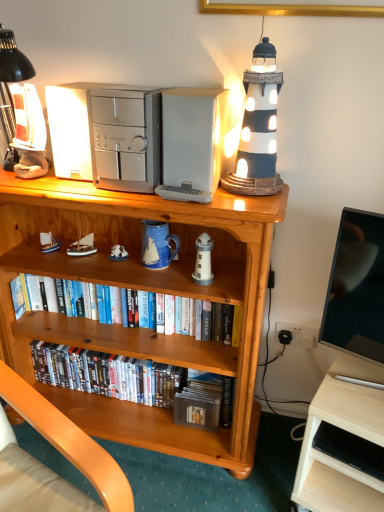
You are a GUI agent. You are given a task and a screenshot of the screen. Output one action in this format:
    pyautogui.click(x=<x>, y=<y>)
    Task: Click on the satin silver appliance at upper left, positioned as the 1th appliance in left-to-right order
    The image size is (384, 512).
    Given the screenshot: What is the action you would take?
    pyautogui.click(x=72, y=130)

Describe the element at coordinates (203, 260) in the screenshot. The width and height of the screenshot is (384, 512). I see `white matte lighthouse at center, which is counted as the 1th toy, starting from the front` at that location.

How much space does white plastic microwave at upper center, which is the 1th appliance from right to left, occupy horizontally?

It is 9.01 inches.

Measure the distance between white wood desk at lower right and camera.

white wood desk at lower right is 3.36 feet away from camera.

This screenshot has width=384, height=512. What do you see at coordinates (118, 253) in the screenshot? I see `white ceramic figurine at center, which appears as the 2th toy when viewed from the right` at bounding box center [118, 253].

Identify the location of white ceramic figurine at center, which appears as the 2th toy when viewed from the right. (118, 253).

Find the location of `hardcover books at center, which ranks as the second book in top-to-bottom order`. hardcover books at center, which ranks as the second book in top-to-bottom order is located at coordinates coord(107,374).

From the picture: Considering the positions of objects white matte lighthouse at center, marked as the third toy in a left-to-right arrangement, and hardcover books at center, arranged as the second book when ordered from the bottom, in the image provided, who is more to the right, white matte lighthouse at center, marked as the third toy in a left-to-right arrangement, or hardcover books at center, arranged as the second book when ordered from the bottom,?

white matte lighthouse at center, marked as the third toy in a left-to-right arrangement.

From a real-world perspective, does white matte lighthouse at center, which is counted as the 1th toy, starting from the front, stand above hardcover books at center, arranged as the second book when ordered from the bottom?

Yes, from a real-world perspective, white matte lighthouse at center, which is counted as the 1th toy, starting from the front, is on top of hardcover books at center, arranged as the second book when ordered from the bottom.

From the image's perspective, is white matte lighthouse at center, marked as the third toy in a left-to-right arrangement, beneath hardcover books at center, arranged as the first book when viewed from the top?

→ No, from the image's perspective, white matte lighthouse at center, marked as the third toy in a left-to-right arrangement, is not below hardcover books at center, arranged as the first book when viewed from the top.

Could you tell me if satin silver appliance at upper left, positioned as the 1th appliance in left-to-right order, is turned towards satin silver computer tower at upper center, placed as the 2th appliance when sorted from left to right?

No, satin silver appliance at upper left, positioned as the 1th appliance in left-to-right order, is not oriented towards satin silver computer tower at upper center, placed as the 2th appliance when sorted from left to right.

Is point (59, 130) farther from viewer compared to point (146, 173)?

That is True.

From the picture: From a real-world perspective, who is located lower, satin silver appliance at upper left, which ranks as the 3th appliance in right-to-left order, or satin silver computer tower at upper center, placed as the 2th appliance when sorted from left to right?

satin silver appliance at upper left, which ranks as the 3th appliance in right-to-left order, is physically lower.

Where is `appliance that is the 2nd object located in front of the satin silver appliance at upper left, positioned as the 1th appliance in left-to-right order`? The height and width of the screenshot is (512, 384). appliance that is the 2nd object located in front of the satin silver appliance at upper left, positioned as the 1th appliance in left-to-right order is located at coordinates (126, 139).

Choose the correct answer: Is hardcover books at center, which is counted as the first book, starting from the bottom, inside matte black lighthouse at upper right or outside it?

hardcover books at center, which is counted as the first book, starting from the bottom, is located beyond the bounds of matte black lighthouse at upper right.

Are hardcover books at center, which ranks as the second book in top-to-bottom order, and matte black lighthouse at upper right beside each other?

No, hardcover books at center, which ranks as the second book in top-to-bottom order, is not next to matte black lighthouse at upper right.

Identify the location of the 2nd book below the matte black lighthouse at upper right (from the image's perspective). This screenshot has height=512, width=384. (107, 374).

What's the angular difference between hardcover books at center, which is counted as the first book, starting from the bottom, and matte black lighthouse at upper right's facing directions?

The angle between the facing direction of hardcover books at center, which is counted as the first book, starting from the bottom, and the facing direction of matte black lighthouse at upper right is 7.42 degrees.

At what (x,y) coordinates should I click in order to perform the action: click on table lamp that is above the white matte lighthouse at center, which is counted as the 1th toy, starting from the front (from the image's perspective). Please return your answer as a coordinate pair (x, y). The image size is (384, 512). Looking at the image, I should click on (258, 128).

Is white matte lighthouse at center, marked as the third toy in a left-to-right arrangement, in contact with matte black lighthouse at upper right?

No, white matte lighthouse at center, marked as the third toy in a left-to-right arrangement, is not in contact with matte black lighthouse at upper right.

Can you confirm if white matte lighthouse at center, which is counted as the 1th toy, starting from the front, is bigger than matte black lighthouse at upper right?

No.

In the scene shown: Which object is thinner, white matte lighthouse at center, which is counted as the 1th toy, starting from the front, or matte black lighthouse at upper right?

With smaller width is white matte lighthouse at center, which is counted as the 1th toy, starting from the front.

Is hardcover books at center, which ranks as the second book in top-to-bottom order, to the left of satin silver appliance at upper left, which ranks as the 3th appliance in right-to-left order, from the viewer's perspective?

In fact, hardcover books at center, which ranks as the second book in top-to-bottom order, is to the right of satin silver appliance at upper left, which ranks as the 3th appliance in right-to-left order.

Does hardcover books at center, which is counted as the first book, starting from the bottom, have a lesser width compared to satin silver appliance at upper left, which ranks as the 3th appliance in right-to-left order?

No.

Is hardcover books at center, which is counted as the first book, starting from the bottom, smaller than satin silver appliance at upper left, positioned as the 1th appliance in left-to-right order?

Actually, hardcover books at center, which is counted as the first book, starting from the bottom, might be larger than satin silver appliance at upper left, positioned as the 1th appliance in left-to-right order.

Between point (67, 379) and point (82, 144), which one is positioned in front?

Point (82, 144)

How far apart are white matte sailboat at upper left, which is counted as the 2th toy, starting from the front, and matte black lighthouse at upper right?

26.35 inches.

Is white matte sailboat at upper left, which appears as the second toy when viewed from the back, closer to the viewer compared to matte black lighthouse at upper right?

No.

From the image's perspective, is white matte sailboat at upper left, which is counted as the 2th toy, starting from the front, positioned above or below matte black lighthouse at upper right?

Based on their image positions, white matte sailboat at upper left, which is counted as the 2th toy, starting from the front, is located beneath matte black lighthouse at upper right.

How different are the orientations of white matte sailboat at upper left, which is counted as the 2th toy, starting from the front, and matte black lighthouse at upper right in degrees?

The angular difference between white matte sailboat at upper left, which is counted as the 2th toy, starting from the front, and matte black lighthouse at upper right is 7.42 degrees.

Does wooden bookcase at center turn towards white wood desk at lower right?

No, wooden bookcase at center is not oriented towards white wood desk at lower right.

From the image's perspective, is wooden bookcase at center over white wood desk at lower right?

Yes, from the image's perspective, wooden bookcase at center is over white wood desk at lower right.

From a real-world perspective, relative to white wood desk at lower right, is wooden bookcase at center vertically above or below?

wooden bookcase at center is situated higher than white wood desk at lower right in the real world.

Are wooden bookcase at center and white wood desk at lower right located far from each other?

Actually, wooden bookcase at center and white wood desk at lower right are a little close together.

From the white matte lighthouse at center, marked as the first toy in a right-to-left arrangement, count the 2nd book to the left and point to it. Please provide its 2D coordinates.

[(107, 304)]

Where is `appliance that is the 2nd object located above the satin silver computer tower at upper center, the second appliance in the right-to-left sequence (from the image's perspective)`? The height and width of the screenshot is (512, 384). appliance that is the 2nd object located above the satin silver computer tower at upper center, the second appliance in the right-to-left sequence (from the image's perspective) is located at coordinates (72, 130).

When comparing their distances from white plastic microwave at upper center, the third appliance when ordered from left to right, does white matte lighthouse at center, marked as the first toy in a right-to-left arrangement, or white matte sailboat at upper left, which is counted as the 2th toy, starting from the front, seem further?

white matte sailboat at upper left, which is counted as the 2th toy, starting from the front, lies further to white plastic microwave at upper center, the third appliance when ordered from left to right, than the other object.

Looking at the image, which one is located closer to satin silver computer tower at upper center, placed as the 2th appliance when sorted from left to right, white matte sailboat at upper left, marked as the 1th toy in a left-to-right arrangement, or blue ceramic mug at center?

The object closer to satin silver computer tower at upper center, placed as the 2th appliance when sorted from left to right, is blue ceramic mug at center.

Considering their positions, is white matte lighthouse at center, marked as the first toy in a right-to-left arrangement, positioned closer to blue ceramic mug at center than wooden bookcase at center?

Among the two, white matte lighthouse at center, marked as the first toy in a right-to-left arrangement, is located nearer to blue ceramic mug at center.

Looking at the image, which one is located further to blue ceramic mug at center, white plastic microwave at upper center, the third appliance when ordered from left to right, or satin silver computer tower at upper center, the second appliance in the right-to-left sequence?

Among the two, satin silver computer tower at upper center, the second appliance in the right-to-left sequence, is located further to blue ceramic mug at center.

Which object lies nearer to the anchor point hardcover books at center, which ranks as the second book in top-to-bottom order, blue ceramic mug at center or white ceramic figurine at center, which is the third toy in front-to-back order?

Based on the image, white ceramic figurine at center, which is the third toy in front-to-back order, appears to be nearer to hardcover books at center, which ranks as the second book in top-to-bottom order.

Estimate the real-world distances between objects in this image. Which object is further from white ceramic figurine at center, which is the third toy in front-to-back order, white plastic microwave at upper center, which is the 1th appliance from right to left, or wooden bookcase at center?

Based on the image, white plastic microwave at upper center, which is the 1th appliance from right to left, appears to be further to white ceramic figurine at center, which is the third toy in front-to-back order.

When comparing their distances from wooden bookcase at center, does satin silver computer tower at upper center, placed as the 2th appliance when sorted from left to right, or matte black lighthouse at upper right seem further?

matte black lighthouse at upper right.

When comparing their distances from white wood desk at lower right, does hardcover books at center, arranged as the first book when viewed from the top, or matte black lighthouse at upper right seem closer?

Based on the image, hardcover books at center, arranged as the first book when viewed from the top, appears to be nearer to white wood desk at lower right.

The image size is (384, 512). What are the coordinates of `bookcase between white matte sailboat at upper left, which appears as the second toy when viewed from the back, and hardcover books at center, which ranks as the second book in top-to-bottom order, vertically` in the screenshot? It's located at (141, 288).

Where is `mug between white matte sailboat at upper left, marked as the 1th toy in a left-to-right arrangement, and white matte lighthouse at center, arranged as the 3th toy when viewed from the back, in the horizontal direction`? The height and width of the screenshot is (512, 384). mug between white matte sailboat at upper left, marked as the 1th toy in a left-to-right arrangement, and white matte lighthouse at center, arranged as the 3th toy when viewed from the back, in the horizontal direction is located at coordinates (157, 245).

Where is `toy between satin silver appliance at upper left, positioned as the 1th appliance in left-to-right order, and blue ceramic mug at center vertically`? toy between satin silver appliance at upper left, positioned as the 1th appliance in left-to-right order, and blue ceramic mug at center vertically is located at coordinates (82, 247).

Find the location of a particular element. mug that lies between matte black lighthouse at upper right and hardcover books at center, arranged as the second book when ordered from the bottom, from top to bottom is located at coordinates (157, 245).